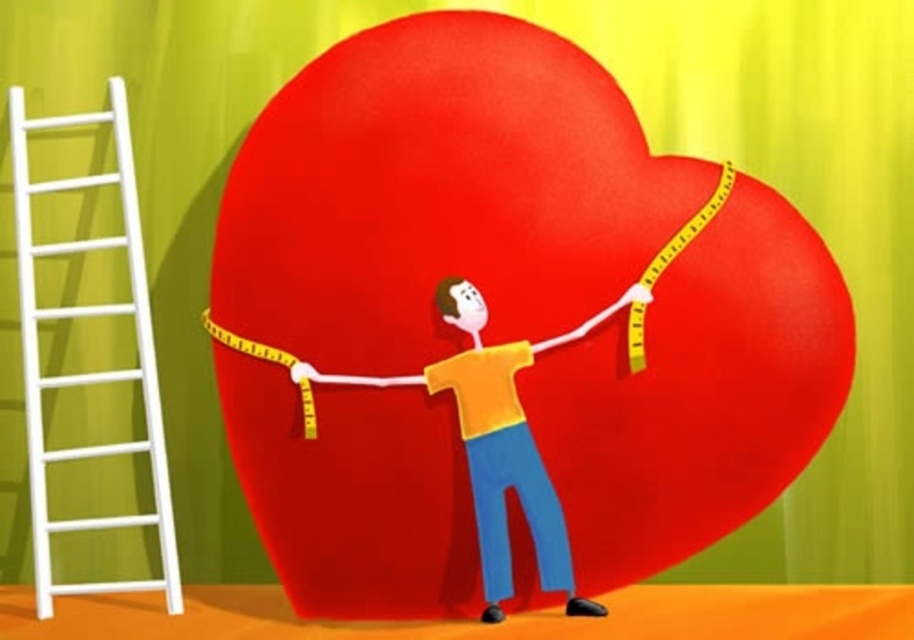
Question: Where is matte red heart at center located in relation to yellow matte shirt at center in the image?

Choices:
 (A) right
 (B) left

Answer: (B)

Question: Which is nearer to the white wooden ladder at left?

Choices:
 (A) yellow matte shirt at center
 (B) matte red heart at center

Answer: (B)

Question: Which object appears closest to the camera in this image?

Choices:
 (A) matte red heart at center
 (B) yellow matte shirt at center
 (C) white wooden ladder at left

Answer: (B)

Question: Is matte red heart at center below white wooden ladder at left?

Choices:
 (A) yes
 (B) no

Answer: (B)

Question: Which point appears closest to the camera in this image?

Choices:
 (A) (447, 337)
 (B) (13, 205)

Answer: (A)

Question: Can you confirm if matte red heart at center is bigger than white wooden ladder at left?

Choices:
 (A) no
 (B) yes

Answer: (B)